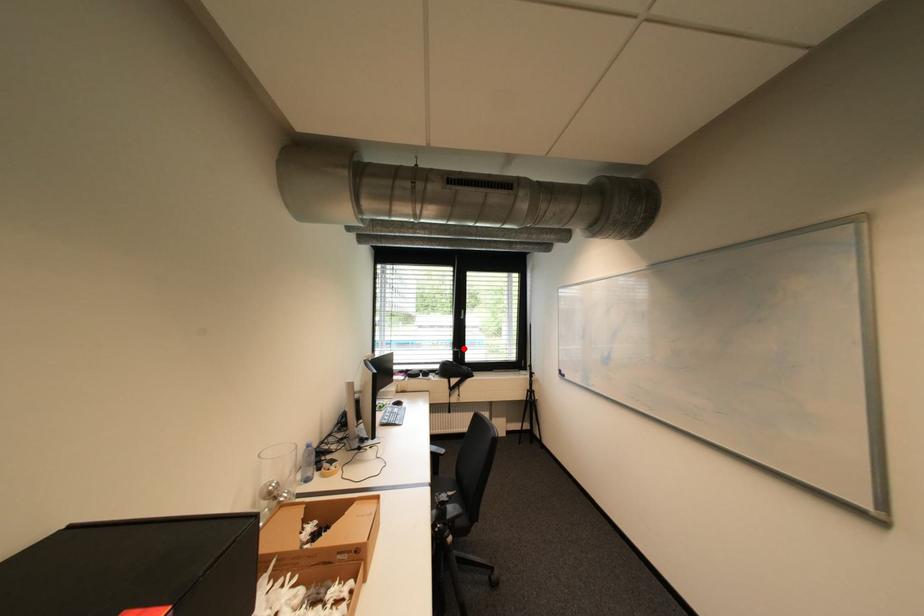
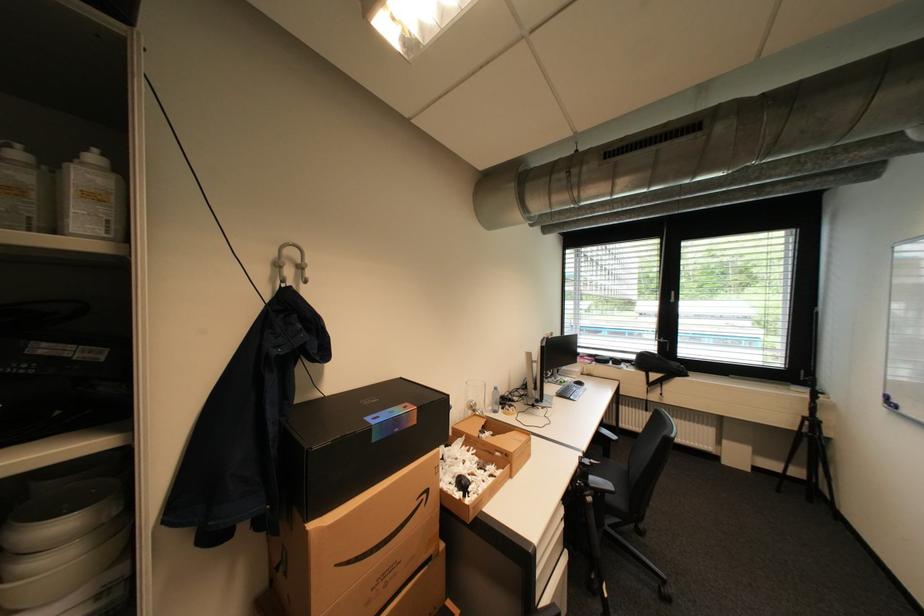
The point at the highlighted location is marked in the first image. Where is the corresponding point in the second image?

(670, 339)